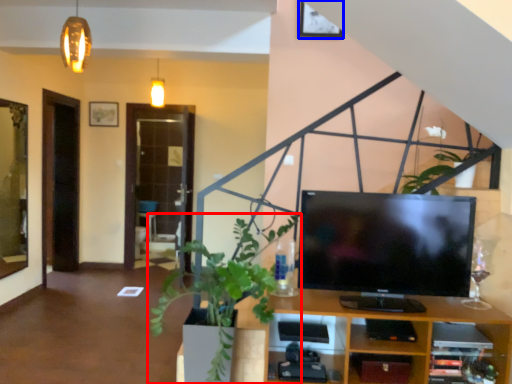
Question: Which object is closer to the camera taking this photo, houseplant (highlighted by a red box) or picture frame (highlighted by a blue box)?

Choices:
 (A) houseplant
 (B) picture frame

Answer: (A)